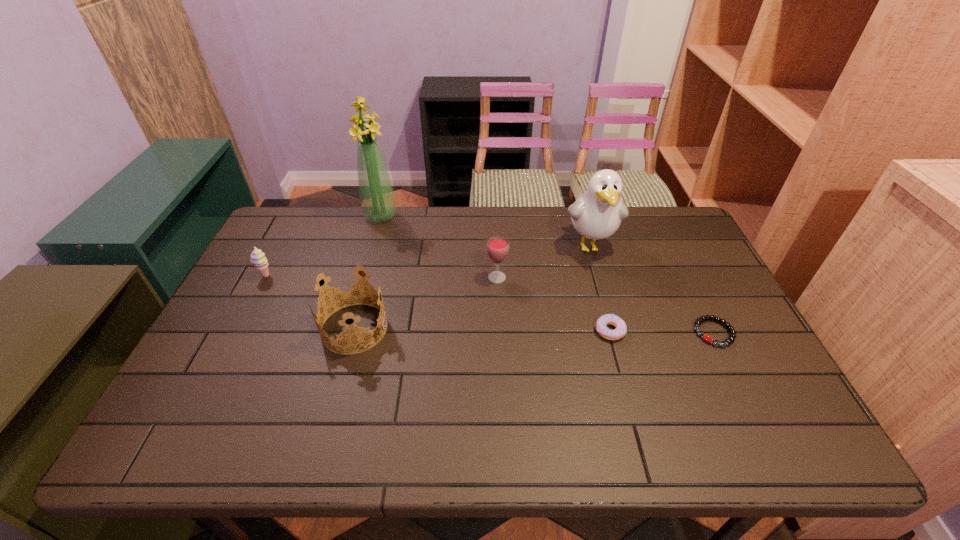
I want to click on vacant space located on the beak of the gull, so click(x=614, y=331).

Identify the location of vacant space located 0.170m on the left of the crown. (258, 328).

Where is `blank area located on the left of the wineglass`? The width and height of the screenshot is (960, 540). blank area located on the left of the wineglass is located at coordinates (434, 278).

Identify the location of vacant region located 0.120m on the front of the leftmost object. The image size is (960, 540). (249, 310).

Where is `vacant space situated on the back of the doughnut`? The image size is (960, 540). vacant space situated on the back of the doughnut is located at coordinates (595, 278).

At what (x,y) coordinates should I click in order to perform the action: click on vacant region located on the back of the bracelet. Please return your answer as a coordinate pair (x, y). This screenshot has height=540, width=960. Looking at the image, I should click on (673, 251).

Image resolution: width=960 pixels, height=540 pixels. I want to click on bouquet that is positioned at the far edge, so click(376, 193).

You are a GUI agent. You are given a task and a screenshot of the screen. Output one action in this format:
    pyautogui.click(x=<x>, y=<y>)
    Task: Click on the gull located in the far edge section of the desktop
    
    Given the screenshot: What is the action you would take?
    pyautogui.click(x=597, y=214)

Where is `object that is at the left edge`? Image resolution: width=960 pixels, height=540 pixels. object that is at the left edge is located at coordinates (258, 258).

Image resolution: width=960 pixels, height=540 pixels. I want to click on object at the right edge, so click(732, 336).